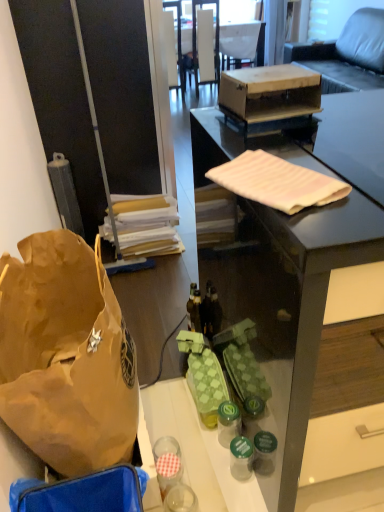
You are a GUI agent. You are given a task and a screenshot of the screen. Output one action in this format:
    pyautogui.click(x=<x>, y=<y>)
    Task: Click on the green glass bottle at lower center, which is the 3th bottle in back-to-front order
    The width and height of the screenshot is (384, 512).
    Given the screenshot: What is the action you would take?
    pos(241,458)

Based on the photo, how much space does green glass bottle at lower center, which is counted as the 1th bottle, starting from the front, occupy horizontally?

green glass bottle at lower center, which is counted as the 1th bottle, starting from the front, is 8.49 centimeters in width.

At what (x,y) coordinates should I click in order to perform the action: click on matte black desk at center. Please return your answer as a coordinate pair (x, y). The width and height of the screenshot is (384, 512). Looking at the image, I should click on (313, 302).

You are a GUI agent. You are given a task and a screenshot of the screen. Output one action in this format:
    pyautogui.click(x=<x>, y=<y>)
    Task: Click on the green plastic bottle at center, the 2th bottle from the back
    The width and height of the screenshot is (384, 512).
    Given the screenshot: What is the action you would take?
    pyautogui.click(x=228, y=422)

In order to click on leather couch at upper right in this screenshot , I will do `click(347, 54)`.

Find the location of a particular element. brown paper bag at left is located at coordinates (66, 356).

What do you see at coordinates (242, 42) in the screenshot? Image resolution: width=384 pixels, height=512 pixels. I see `white fabric armchair at upper center` at bounding box center [242, 42].

Locate an element on the screen. white glossy chair at upper center is located at coordinates (205, 45).

Identify the location of green glass bottle at lower center, which ranks as the first bottle in bottom-to-top order. This screenshot has width=384, height=512. (241, 458).

Consider the image. From a real-world perspective, is matte black desk at center beneath green plastic bottle at center, placed as the second bottle when sorted from bottom to top?

No, from a real-world perspective, matte black desk at center is not below green plastic bottle at center, placed as the second bottle when sorted from bottom to top.

Is matte black desk at center in front of or behind green plastic bottle at center, the second bottle viewed from the top, in the image?

Clearly, matte black desk at center is in front of green plastic bottle at center, the second bottle viewed from the top.

Can you see matte black desk at center touching green plastic bottle at center, placed as the second bottle when sorted from bottom to top?

No, matte black desk at center is not next to green plastic bottle at center, placed as the second bottle when sorted from bottom to top.

Is matte black desk at center spatially inside green plastic bottle at center, the second bottle viewed from the top, or outside of it?

matte black desk at center is not inside green plastic bottle at center, the second bottle viewed from the top, it's outside.

From a real-world perspective, is white fabric armchair at upper center physically below matte black desk at center?

Incorrect, from a real-world perspective, white fabric armchair at upper center is higher than matte black desk at center.

Considering the sizes of objects white fabric armchair at upper center and matte black desk at center in the image provided, who is thinner, white fabric armchair at upper center or matte black desk at center?

Thinner between the two is white fabric armchair at upper center.

Is white fabric armchair at upper center situated inside matte black desk at center or outside?

white fabric armchair at upper center lies outside matte black desk at center.

Based on the photo, which of these two, white fabric armchair at upper center or matte black desk at center, stands shorter?

Standing shorter between the two is white fabric armchair at upper center.

Considering the sizes of objects leather couch at upper right and brown paper bag at left in the image provided, who is smaller, leather couch at upper right or brown paper bag at left?

With smaller size is brown paper bag at left.

Is leather couch at upper right placed right next to brown paper bag at left?

They are not placed beside each other.

This screenshot has width=384, height=512. Identify the location of studio couch located above the brown paper bag at left (from the image's perspective). (347, 54).

Which is more to the left, wooden box at center or green glass bottle at lower center, which is the 3th bottle in back-to-front order?

green glass bottle at lower center, which is the 3th bottle in back-to-front order.

The width and height of the screenshot is (384, 512). Identify the location of box located on the right of green glass bottle at lower center, which is counted as the 3th bottle, starting from the top. (270, 92).

Is wooden box at center bigger than green glass bottle at lower center, which is counted as the 1th bottle, starting from the front?

Correct, wooden box at center is larger in size than green glass bottle at lower center, which is counted as the 1th bottle, starting from the front.

In the scene shown: Is leather couch at upper right to the left or to the right of wooden box at center in the image?

In the image, leather couch at upper right appears on the right side of wooden box at center.

Based on the photo, is leather couch at upper right directly adjacent to wooden box at center?

No, leather couch at upper right is not with wooden box at center.

At what (x,y) coordinates should I click in order to perform the action: click on studio couch lying above the wooden box at center (from the image's perspective). Please return your answer as a coordinate pair (x, y). Image resolution: width=384 pixels, height=512 pixels. Looking at the image, I should click on (347, 54).

Is the position of leather couch at upper right more distant than that of wooden box at center?

Yes, it is behind wooden box at center.

From the image's perspective, would you say green glass bottle at lower center, which is counted as the 3th bottle, starting from the top, is shown under translucent plastic bottle at center, the 3th bottle from the bottom?

Indeed, from the image's perspective, green glass bottle at lower center, which is counted as the 3th bottle, starting from the top, is shown beneath translucent plastic bottle at center, the 3th bottle from the bottom.

What's the angular difference between green glass bottle at lower center, which ranks as the first bottle in bottom-to-top order, and translucent plastic bottle at center, which ranks as the 3th bottle in front-to-back order,'s facing directions?

They differ by 180 degrees in their facing directions.

From a real-world perspective, is green glass bottle at lower center, which is counted as the 1th bottle, starting from the front, under translucent plastic bottle at center, placed as the first bottle when sorted from back to front?

Correct, in the physical world, green glass bottle at lower center, which is counted as the 1th bottle, starting from the front, is lower than translucent plastic bottle at center, placed as the first bottle when sorted from back to front.

Based on the photo, can you confirm if green glass bottle at lower center, which is the 3th bottle in back-to-front order, is shorter than translucent plastic bottle at center, placed as the first bottle when sorted from back to front?

Correct, green glass bottle at lower center, which is the 3th bottle in back-to-front order, is not as tall as translucent plastic bottle at center, placed as the first bottle when sorted from back to front.

From a real-world perspective, is wooden box at center under matte black desk at center?

No, from a real-world perspective, wooden box at center is not under matte black desk at center.

Is wooden box at center looking in the opposite direction of matte black desk at center?

No, wooden box at center's orientation is not away from matte black desk at center.

At what (x,y) coordinates should I click in order to perform the action: click on desk that is in front of the wooden box at center. Please return your answer as a coordinate pair (x, y). Image resolution: width=384 pixels, height=512 pixels. Looking at the image, I should click on (313, 302).

Is wooden box at center not close to matte black desk at center?

Actually, wooden box at center and matte black desk at center are a little close together.

This screenshot has width=384, height=512. Identify the location of desk above the green plastic bottle at center, the second bottle when ordered from front to back (from a real-world perspective). (313, 302).

You are a GUI agent. You are given a task and a screenshot of the screen. Output one action in this format:
    pyautogui.click(x=<x>, y=<y>)
    Task: Click on the armchair above the matte black desk at center (from the image's perspective)
    The width and height of the screenshot is (384, 512).
    Given the screenshot: What is the action you would take?
    pyautogui.click(x=242, y=42)

Looking at the image, which one is located further to matte black desk at center, green plastic bottle at center, the 2th bottle from the back, or translucent plastic bottle at center, the first bottle positioned from the top?

translucent plastic bottle at center, the first bottle positioned from the top, lies further to matte black desk at center than the other object.

Based on their spatial positions, is green plastic bottle at center, the second bottle when ordered from front to back, or brown paper bag at left closer to translucent plastic bottle at center, which ranks as the 3th bottle in front-to-back order?

The object closer to translucent plastic bottle at center, which ranks as the 3th bottle in front-to-back order, is green plastic bottle at center, the second bottle when ordered from front to back.

When comparing their distances from matte black desk at center, does white fabric armchair at upper center or brown paper bag at left seem closer?

Among the two, brown paper bag at left is located nearer to matte black desk at center.

Considering their positions, is leather couch at upper right positioned closer to green plastic bottle at center, the 2th bottle from the back, than white fabric armchair at upper center?

white fabric armchair at upper center is positioned closer to the anchor green plastic bottle at center, the 2th bottle from the back.

Consider the image. Considering their positions, is matte black desk at center positioned further to leather couch at upper right than green plastic bottle at center, the second bottle when ordered from front to back?

Among the two, green plastic bottle at center, the second bottle when ordered from front to back, is located further to leather couch at upper right.

Estimate the real-world distances between objects in this image. Which object is closer to white fabric armchair at upper center, brown paper bag at left or green plastic bottle at center, the second bottle viewed from the top?

Based on the image, brown paper bag at left appears to be nearer to white fabric armchair at upper center.

Considering their positions, is white fabric armchair at upper center positioned further to wooden box at center than green glass bottle at lower center, which is the 3th bottle in back-to-front order?

white fabric armchair at upper center lies further to wooden box at center than the other object.

When comparing their distances from brown paper bag at left, does green plastic bottle at center, the second bottle viewed from the top, or white fabric armchair at upper center seem further?

Among the two, white fabric armchair at upper center is located further to brown paper bag at left.

Locate an element on the screen. The height and width of the screenshot is (512, 384). studio couch positioned between brown paper bag at left and white fabric armchair at upper center from near to far is located at coordinates (347, 54).

This screenshot has height=512, width=384. I want to click on box positioned between brown paper bag at left and white glossy chair at upper center from near to far, so click(270, 92).

Where is `studio couch between brown paper bag at left and white glossy chair at upper center in the front-back direction`? studio couch between brown paper bag at left and white glossy chair at upper center in the front-back direction is located at coordinates (347, 54).

Where is `handbag that lies between wooden box at center and green plastic bottle at center, the second bottle when ordered from front to back, from top to bottom`? The image size is (384, 512). handbag that lies between wooden box at center and green plastic bottle at center, the second bottle when ordered from front to back, from top to bottom is located at coordinates (66, 356).